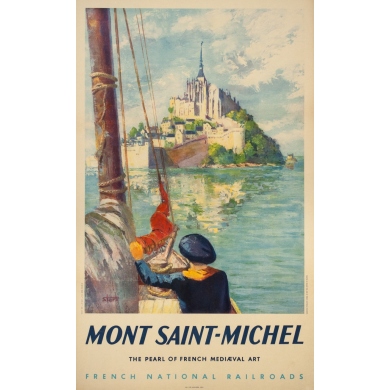
You are a GUI agent. You are given a task and a screenshot of the screen. Output one action in this format:
    pyautogui.click(x=<x>, y=<y>)
    Task: Click on the fabric
    The image size is (390, 390).
    Given the screenshot: What is the action you would take?
    pyautogui.click(x=125, y=277)